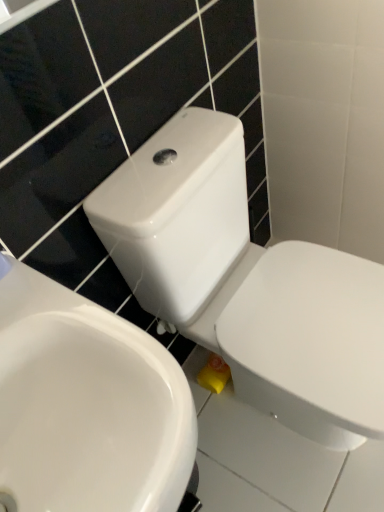
Question: From the image's perspective, is white glossy toilet at center positioned above or below white glossy sink at center?

Choices:
 (A) above
 (B) below

Answer: (A)

Question: From a real-world perspective, is white glossy toilet at center positioned above or below white glossy sink at center?

Choices:
 (A) below
 (B) above

Answer: (A)

Question: Considering the positions of point (347, 309) and point (165, 445), is point (347, 309) closer or farther from the camera than point (165, 445)?

Choices:
 (A) closer
 (B) farther

Answer: (B)

Question: Is white glossy sink at center inside or outside of white glossy toilet at center?

Choices:
 (A) outside
 (B) inside

Answer: (A)

Question: From their relative heights in the image, would you say white glossy sink at center is taller or shorter than white glossy toilet at center?

Choices:
 (A) short
 (B) tall

Answer: (A)

Question: Is white glossy sink at center wider or thinner than white glossy toilet at center?

Choices:
 (A) thin
 (B) wide

Answer: (A)

Question: Based on their sizes in the image, would you say white glossy sink at center is bigger or smaller than white glossy toilet at center?

Choices:
 (A) big
 (B) small

Answer: (B)